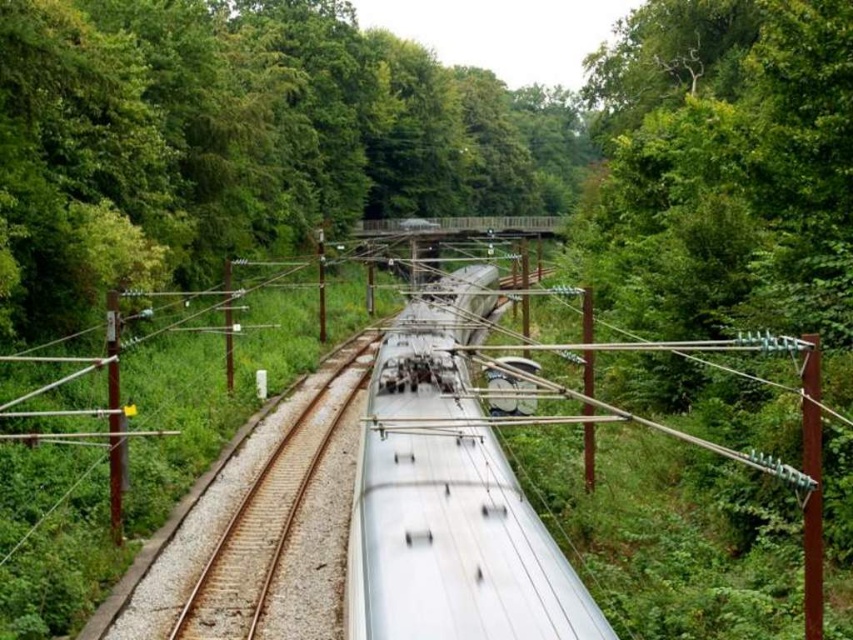
You are a maintenance worker responsible for ensuring the safety of the railway. You need to check the distance between the silver metallic train at center and the metallic silver train track at center. What is the minimum safe distance required between them according to safety regulations? Is the current distance sufficient?

The minimum safe distance between the silver metallic train at center and the metallic silver train track at center is typically 4.5 meters. The current distance of 4.64 meters exceeds this requirement, so it is sufficient.

You are a maintenance worker checking the clearance of the railway. The silver metallic train at center is passing over the metallic silver train track at center. Which object has a greater height?

The silver metallic train at center is much taller than the metallic silver train track at center.

You are a photographer standing at the edge of the forest, looking at the railway tracks. You notice two points marked on the tracks. Which point, point (416, 305) or point (291, 497), is closer to your camera position?

Point (291, 497) is closer to the camera position because it is less further than point (416, 305).